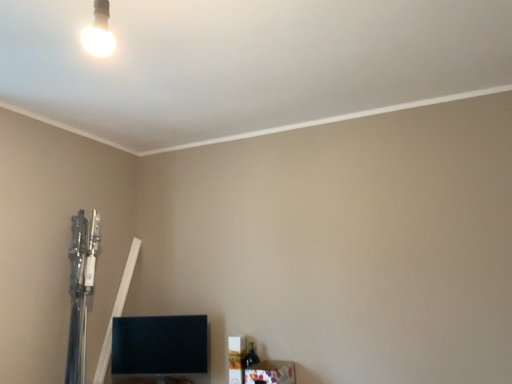
Question: Are wooden frame at lower right, which is counted as the 2th furniture, starting from the back, and white glossy bulb at upper left far apart?

Choices:
 (A) yes
 (B) no

Answer: (A)

Question: Does wooden frame at lower right, which is the 1th furniture from right to left, appear on the right side of white glossy bulb at upper left?

Choices:
 (A) no
 (B) yes

Answer: (B)

Question: Considering the relative sizes of wooden frame at lower right, which ranks as the 1th furniture in front-to-back order, and white glossy bulb at upper left in the image provided, is wooden frame at lower right, which ranks as the 1th furniture in front-to-back order, bigger than white glossy bulb at upper left?

Choices:
 (A) yes
 (B) no

Answer: (A)

Question: Can you confirm if wooden frame at lower right, which is counted as the 2th furniture, starting from the back, is thinner than white glossy bulb at upper left?

Choices:
 (A) no
 (B) yes

Answer: (A)

Question: Is wooden frame at lower right, which is the 1th furniture from right to left, smaller than white glossy bulb at upper left?

Choices:
 (A) yes
 (B) no

Answer: (B)

Question: Looking at the image, does black glossy tv at lower left, acting as the second furniture starting from the front, seem bigger or smaller compared to wooden frame at lower right, which is the 1th furniture from right to left?

Choices:
 (A) big
 (B) small

Answer: (A)

Question: In the image, is black glossy tv at lower left, which ranks as the first furniture in back-to-front order, positioned in front of or behind wooden frame at lower right, positioned as the second furniture in left-to-right order?

Choices:
 (A) behind
 (B) front

Answer: (A)

Question: Is black glossy tv at lower left, the 2th furniture viewed from the right, taller or shorter than wooden frame at lower right, positioned as the second furniture in left-to-right order?

Choices:
 (A) short
 (B) tall

Answer: (B)

Question: Is point (135, 336) closer or farther from the camera than point (291, 362)?

Choices:
 (A) farther
 (B) closer

Answer: (A)

Question: Considering their positions, is white glossy bulb at upper left located in front of or behind black glossy tv at lower left, which ranks as the first furniture in back-to-front order?

Choices:
 (A) front
 (B) behind

Answer: (A)

Question: In terms of height, does white glossy bulb at upper left look taller or shorter compared to black glossy tv at lower left, the 2th furniture viewed from the right?

Choices:
 (A) short
 (B) tall

Answer: (A)

Question: Looking at the image, does white glossy bulb at upper left seem bigger or smaller compared to black glossy tv at lower left, the first furniture positioned from the left?

Choices:
 (A) small
 (B) big

Answer: (A)

Question: Is white glossy bulb at upper left wider or thinner than black glossy tv at lower left, acting as the second furniture starting from the front?

Choices:
 (A) thin
 (B) wide

Answer: (A)

Question: Considering the positions of white glossy bulb at upper left and wooden frame at lower right, which ranks as the 1th furniture in front-to-back order, in the image, is white glossy bulb at upper left taller or shorter than wooden frame at lower right, which ranks as the 1th furniture in front-to-back order,?

Choices:
 (A) tall
 (B) short

Answer: (A)

Question: Considering their positions, is white glossy bulb at upper left located in front of or behind wooden frame at lower right, which is counted as the 2th furniture, starting from the back?

Choices:
 (A) front
 (B) behind

Answer: (A)